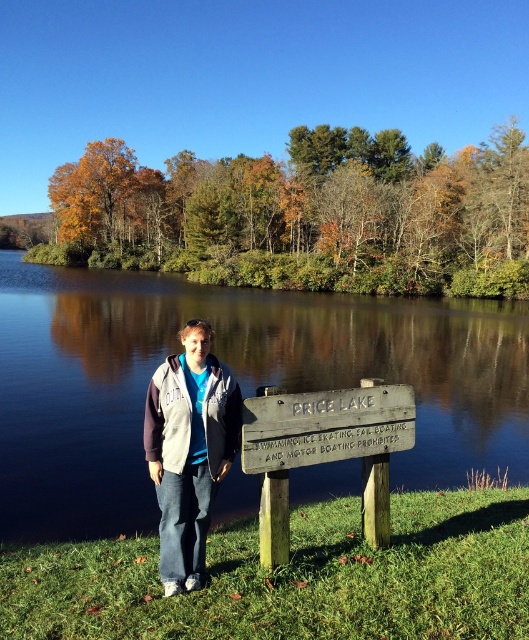
Consider the image. You are standing at the edge of Price Lake and want to place a small floating dock between the smooth dark water at center and the weathered wood sign at center. Based on their widths, can the dock fit between them?

The smooth dark water at center might be wider than weathered wood sign at center, so the dock could potentially fit if the water is wide enough. However, the exact width isn not specified, so it depends on the actual measurement.

From the picture: You are standing at the wooden sign at Price Lake and want to locate the smooth dark water at center. According to the coordinates provided, in which direction should you walk to reach it?

The smooth dark water at center is located at coordinates point (236, 378). Since the coordinate system typically has (0, 0) at the bottom left corner, moving towards higher x values means moving to the right and higher y values mean moving upwards. Therefore, to reach the smooth dark water at center from the wooden sign, you should walk to the right and upwards.